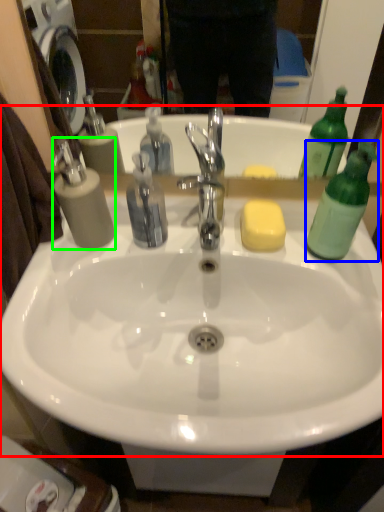
Question: Considering the real-world distances, which object is farthest from sink (highlighted by a red box)? bottle (highlighted by a blue box) or soap dispenser (highlighted by a green box)?

Choices:
 (A) bottle
 (B) soap dispenser

Answer: (A)